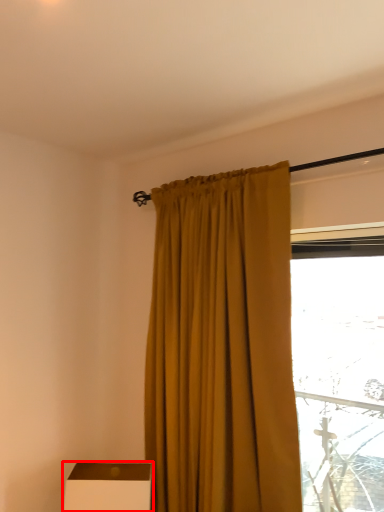
Question: From the image's perspective, where is furniture (annotated by the red box) located relative to curtain?

Choices:
 (A) above
 (B) below

Answer: (B)